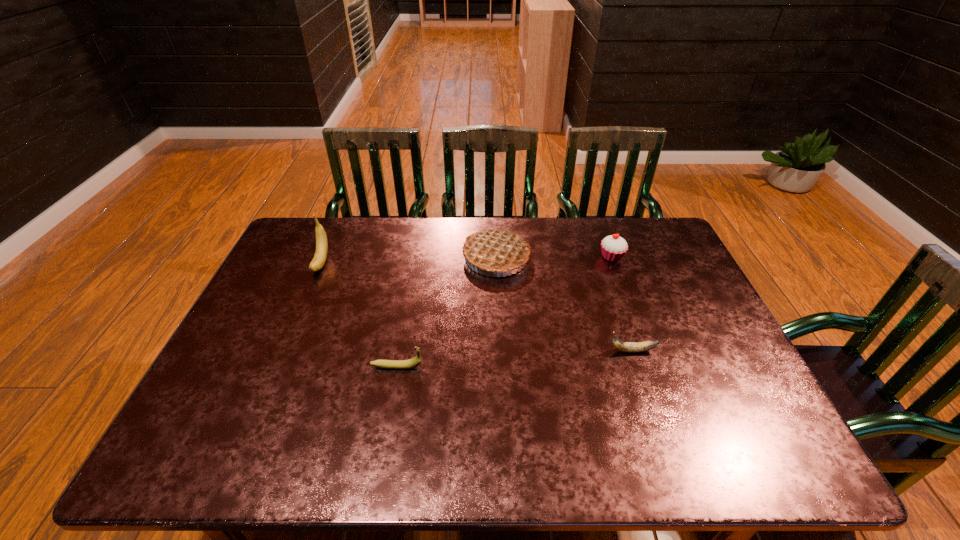
Find the location of `free location located on the back of the cupcake`. free location located on the back of the cupcake is located at coordinates (603, 233).

This screenshot has height=540, width=960. I want to click on vacant region located at the stem of the nearest banana, so click(563, 367).

Find the location of `vacant space situated on the peel of the shortest banana`. vacant space situated on the peel of the shortest banana is located at coordinates (532, 351).

The width and height of the screenshot is (960, 540). I want to click on vacant point located 0.150m on the peel of the shortest banana, so click(551, 351).

This screenshot has width=960, height=540. Find the location of `free space located 0.360m on the peel of the shortest banana`. free space located 0.360m on the peel of the shortest banana is located at coordinates (470, 351).

In order to click on pie positioned at the far edge in this screenshot , I will do `click(496, 250)`.

I want to click on banana that is at the far edge, so tap(320, 256).

This screenshot has width=960, height=540. Find the location of `cupcake that is at the far edge`. cupcake that is at the far edge is located at coordinates (613, 247).

You are a GUI agent. You are given a task and a screenshot of the screen. Output one action in this format:
    pyautogui.click(x=<x>, y=<y>)
    Task: Click on the object at the left edge
    This screenshot has width=960, height=540.
    Given the screenshot: What is the action you would take?
    pyautogui.click(x=320, y=256)

Locate an element on the screen. This screenshot has width=960, height=540. object that is at the far left corner is located at coordinates (320, 256).